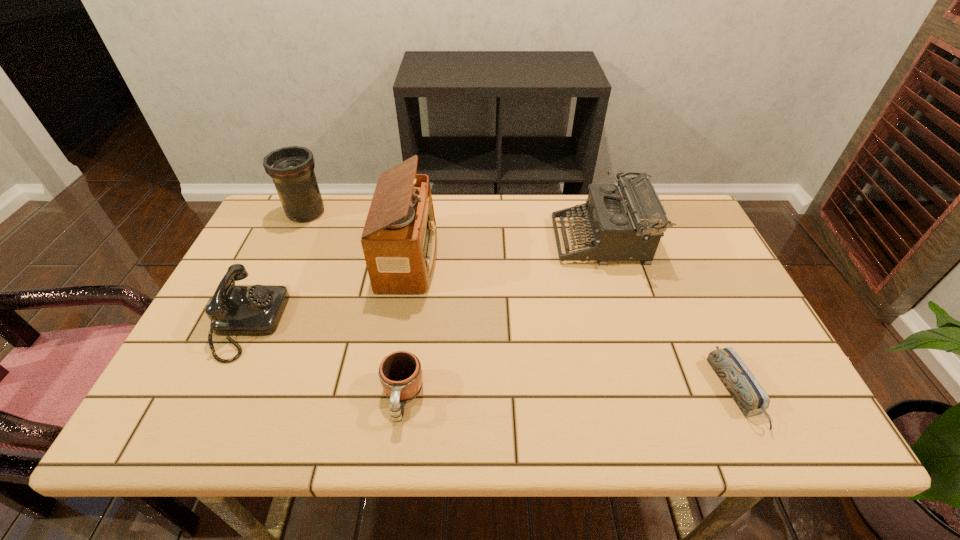
At what (x,y) coordinates should I click in order to perform the action: click on vacant space located on the typing side of the typewriter. Please return your answer as a coordinate pair (x, y). Looking at the image, I should click on (504, 241).

You are a GUI agent. You are given a task and a screenshot of the screen. Output one action in this format:
    pyautogui.click(x=<x>, y=<y>)
    Task: Click on the free region located 0.340m on the typing side of the typewriter
    The image size is (960, 540).
    Given the screenshot: What is the action you would take?
    pyautogui.click(x=440, y=241)

In order to click on vacant area located on the dial of the third shortest object in this screenshot , I will do pyautogui.click(x=365, y=324).

Locate an element on the screen. free point located 0.130m on the left of the shortest object is located at coordinates (659, 392).

Find the location of a particular element. Image resolution: width=960 pixels, height=540 pixels. radio receiver situated at the far edge is located at coordinates pos(399,240).

Where is `telephoto lens positioned at the far edge`? telephoto lens positioned at the far edge is located at coordinates (292, 168).

Locate an element on the screen. This screenshot has height=540, width=960. typewriter at the far edge is located at coordinates (626, 221).

Identify the location of mug at the near edge. (400, 373).

Identify the location of pencil box that is at the near edge. This screenshot has height=540, width=960. (750, 397).

You are a GUI agent. You are given a task and a screenshot of the screen. Output one action in this format:
    pyautogui.click(x=<x>, y=<y>)
    Task: Click on the telephoto lens situated at the left edge
    The width and height of the screenshot is (960, 540).
    Given the screenshot: What is the action you would take?
    pyautogui.click(x=292, y=168)